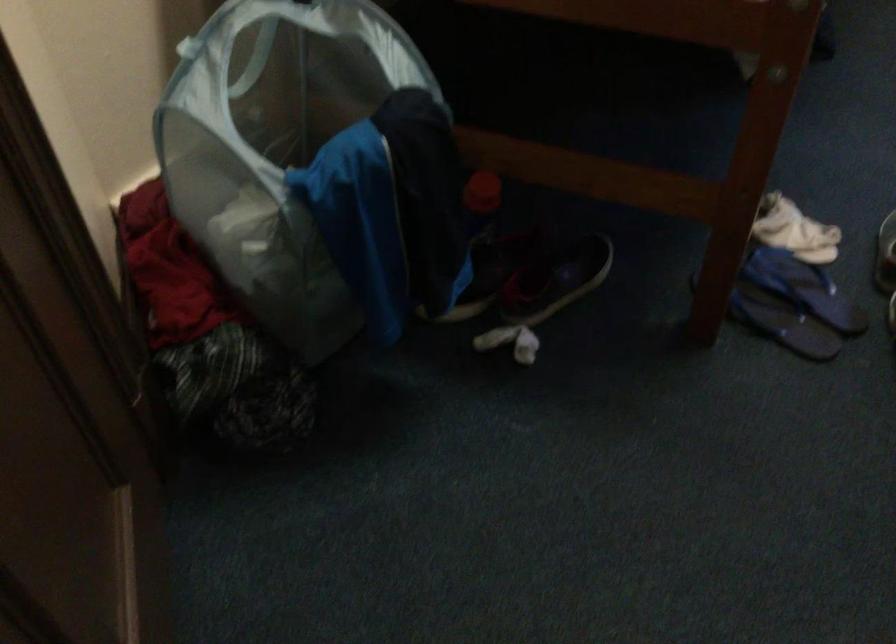
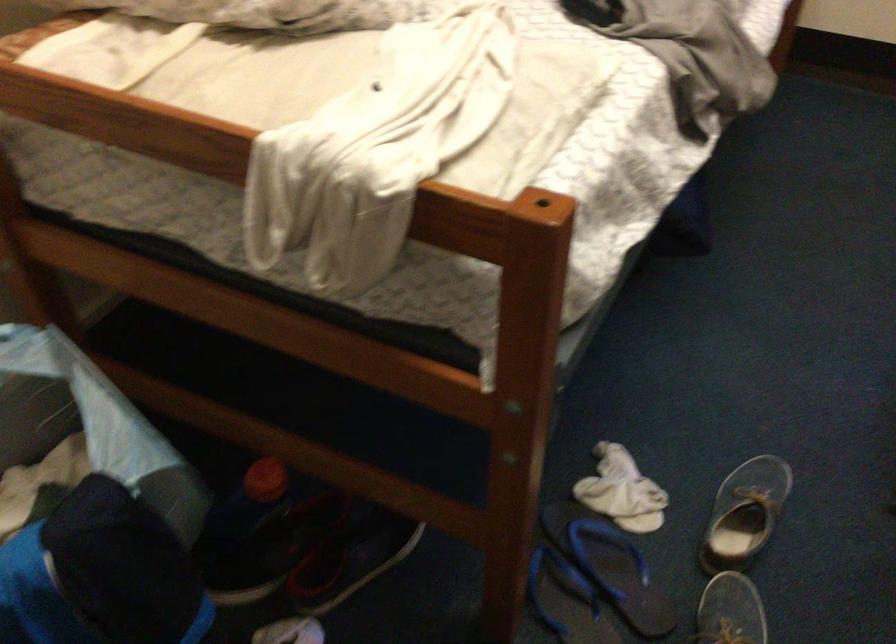
Find the pixel in the second image that matches [759,314] in the first image.

(566, 600)